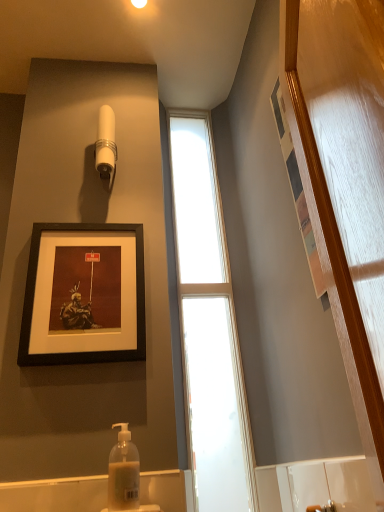
Question: Considering the relative sizes of clear glass window at center and translucent plastic soap dispenser at lower center in the image provided, is clear glass window at center shorter than translucent plastic soap dispenser at lower center?

Choices:
 (A) no
 (B) yes

Answer: (A)

Question: Considering the relative sizes of clear glass window at center and translucent plastic soap dispenser at lower center in the image provided, is clear glass window at center thinner than translucent plastic soap dispenser at lower center?

Choices:
 (A) no
 (B) yes

Answer: (B)

Question: Is clear glass window at center smaller than translucent plastic soap dispenser at lower center?

Choices:
 (A) no
 (B) yes

Answer: (A)

Question: Considering the relative positions of clear glass window at center and translucent plastic soap dispenser at lower center in the image provided, is clear glass window at center to the left of translucent plastic soap dispenser at lower center from the viewer's perspective?

Choices:
 (A) no
 (B) yes

Answer: (A)

Question: Would you say clear glass window at center is outside translucent plastic soap dispenser at lower center?

Choices:
 (A) no
 (B) yes

Answer: (B)

Question: From a real-world perspective, is clear glass window at center beneath translucent plastic soap dispenser at lower center?

Choices:
 (A) yes
 (B) no

Answer: (B)

Question: Is white plastic shower head at upper center to the right of matte black frame at upper center from the viewer's perspective?

Choices:
 (A) yes
 (B) no

Answer: (A)

Question: Does white plastic shower head at upper center have a greater width compared to matte black frame at upper center?

Choices:
 (A) no
 (B) yes

Answer: (B)

Question: From a real-world perspective, is white plastic shower head at upper center positioned over matte black frame at upper center based on gravity?

Choices:
 (A) no
 (B) yes

Answer: (B)

Question: Can you confirm if white plastic shower head at upper center is shorter than matte black frame at upper center?

Choices:
 (A) no
 (B) yes

Answer: (B)

Question: Is white plastic shower head at upper center behind matte black frame at upper center?

Choices:
 (A) no
 (B) yes

Answer: (B)

Question: Considering the relative sizes of white plastic shower head at upper center and matte black frame at upper center in the image provided, is white plastic shower head at upper center smaller than matte black frame at upper center?

Choices:
 (A) no
 (B) yes

Answer: (B)

Question: Considering the relative sizes of matte black frame at upper center and translucent plastic soap dispenser at lower center in the image provided, is matte black frame at upper center thinner than translucent plastic soap dispenser at lower center?

Choices:
 (A) yes
 (B) no

Answer: (A)